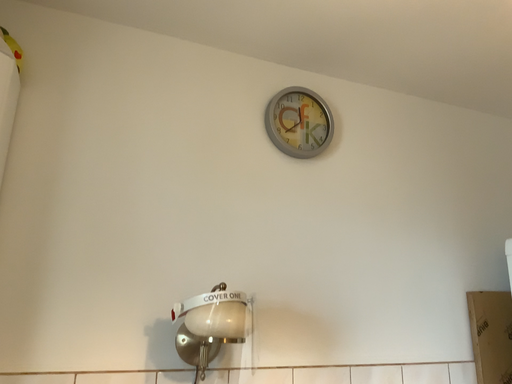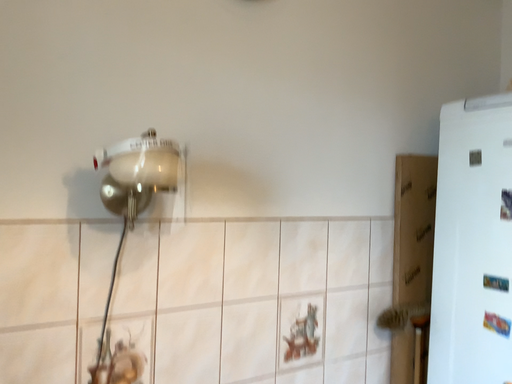
Question: Which way did the camera rotate in the video?

Choices:
 (A) rotated right
 (B) rotated left

Answer: (A)